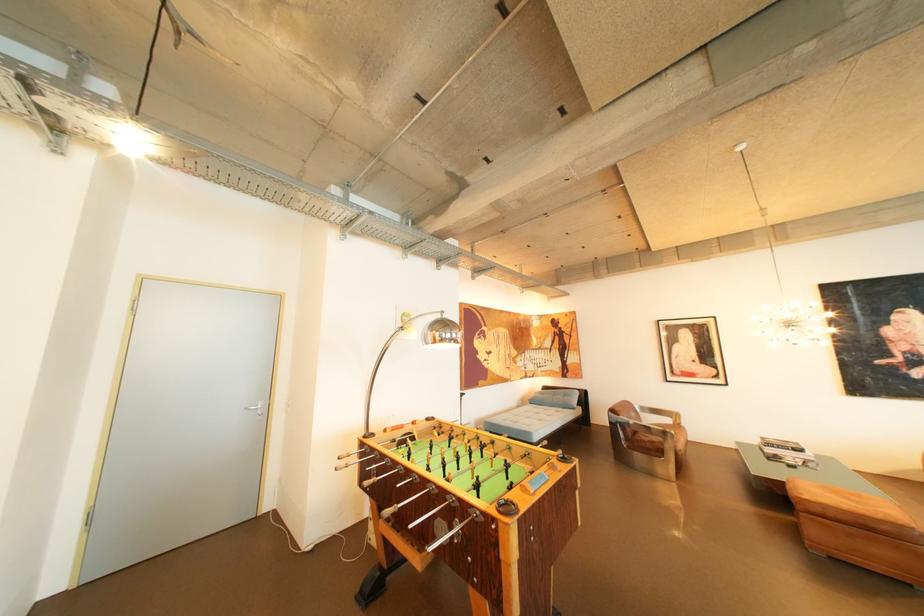
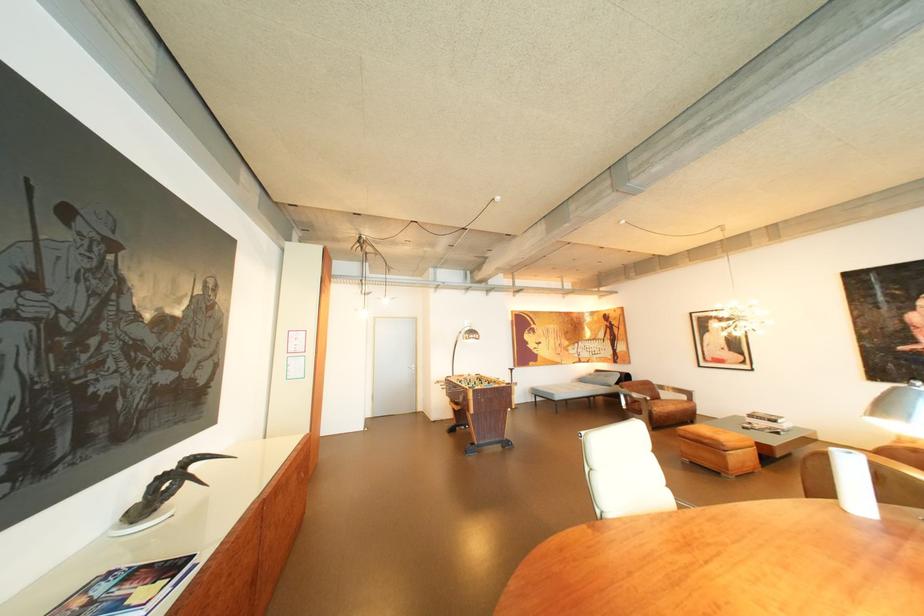
What movement of the cameraman would produce the second image?

The cameraman walked toward right, backward.